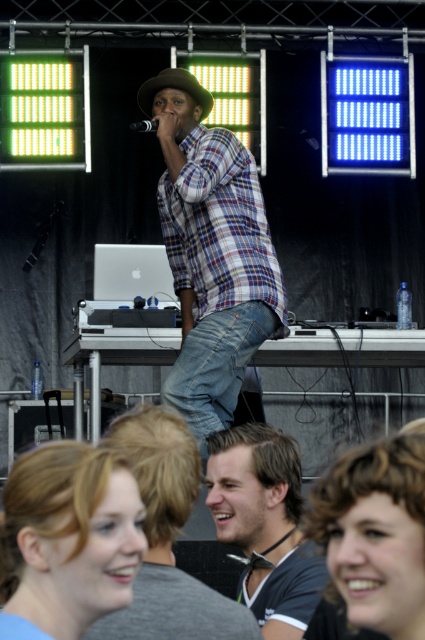
Is plaid cotton shirt at center to the left of dark brown hair at center from the viewer's perspective?

Indeed, plaid cotton shirt at center is positioned on the left side of dark brown hair at center.

Who is lower down, plaid cotton shirt at center or dark brown hair at center?

dark brown hair at center

What do you see at coordinates (210, 252) in the screenshot?
I see `plaid cotton shirt at center` at bounding box center [210, 252].

At what (x,y) coordinates should I click in order to perform the action: click on plaid cotton shirt at center. Please return your answer as a coordinate pair (x, y). Looking at the image, I should click on (210, 252).

Does plaid cotton shirt at center appear over blonde hair at lower right?

Indeed, plaid cotton shirt at center is positioned over blonde hair at lower right.

Which of these two, plaid cotton shirt at center or blonde hair at lower right, stands taller?

With more height is plaid cotton shirt at center.

Where is `plaid cotton shirt at center`? plaid cotton shirt at center is located at coordinates (210, 252).

At what (x,y) coordinates should I click in order to perform the action: click on plaid cotton shirt at center. Please return your answer as a coordinate pair (x, y). This screenshot has width=425, height=640. Looking at the image, I should click on (x=210, y=252).

Which is above, plaid cotton shirt at center or denim jeans at center?

plaid cotton shirt at center is above.

Which of these two, plaid cotton shirt at center or denim jeans at center, stands taller?

With more height is plaid cotton shirt at center.

Is point (206, 172) in front of point (220, 310)?

No.

You are a GUI agent. You are given a task and a screenshot of the screen. Output one action in this format:
    pyautogui.click(x=<x>, y=<y>)
    Task: Click on the plaid cotton shirt at center
    The height and width of the screenshot is (640, 425).
    Given the screenshot: What is the action you would take?
    pyautogui.click(x=210, y=252)